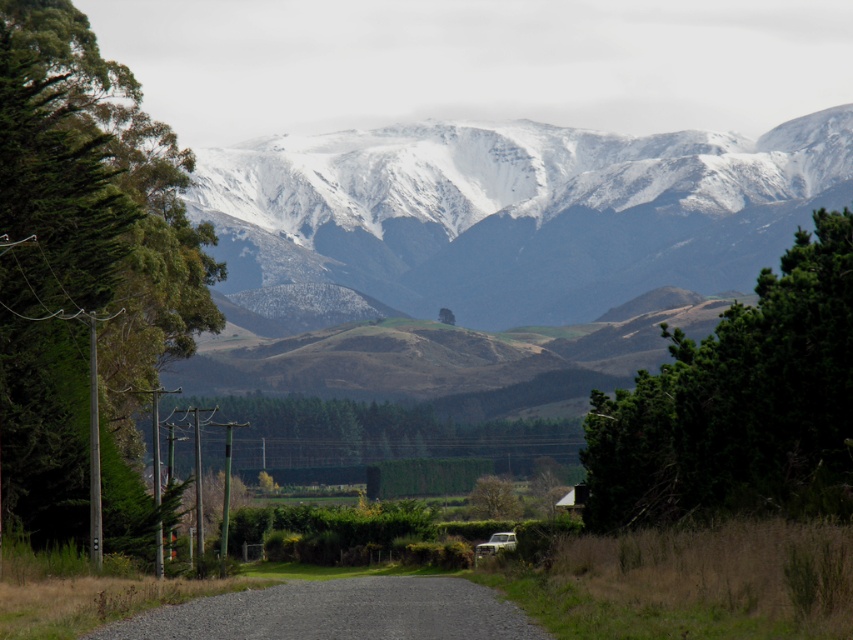
Which is above, green leafy tree at left or green leafy tree at center?

Positioned higher is green leafy tree at left.

Can you confirm if green leafy tree at left is positioned below green leafy tree at center?

Actually, green leafy tree at left is above green leafy tree at center.

Does point (49, 104) lie in front of point (483, 493)?

Yes, it is.

Locate an element on the screen. green leafy tree at left is located at coordinates (86, 273).

Does point (715, 232) lie behind point (848, 499)?

Yes, point (715, 232) is behind point (848, 499).

Find the location of a particular element. The width and height of the screenshot is (853, 640). snowy rock mountain range at upper center is located at coordinates (517, 212).

Measure the distance from green textured forest at center to green leafy tree at center.

They are 30.33 meters apart.

Based on the photo, which of these two, green textured forest at center or green leafy tree at center, stands taller?

With more height is green textured forest at center.

Describe the element at coordinates (392, 435) in the screenshot. The width and height of the screenshot is (853, 640). I see `green textured forest at center` at that location.

Where is `green textured forest at center`? green textured forest at center is located at coordinates (392, 435).